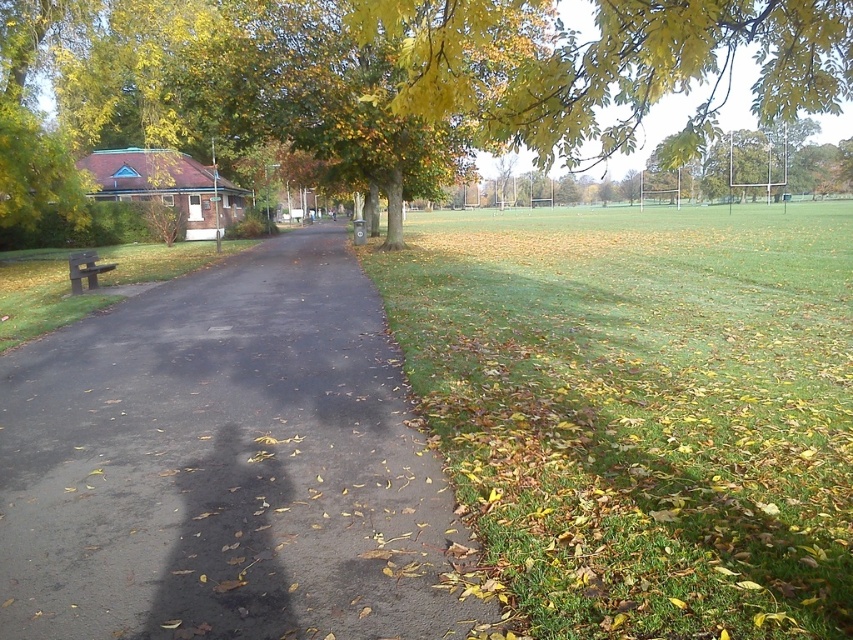
Question: Where is black asphalt pavement at left located in relation to green leafy tree at upper center in the image?

Choices:
 (A) below
 (B) above

Answer: (A)

Question: Where is black asphalt pavement at left located in relation to metallic park bench at left in the image?

Choices:
 (A) left
 (B) right

Answer: (B)

Question: Is the position of black asphalt pavement at left more distant than that of metallic park bench at left?

Choices:
 (A) yes
 (B) no

Answer: (B)

Question: Estimate the real-world distances between objects in this image. Which object is closer to the green leafy tree at upper center?

Choices:
 (A) metallic park bench at left
 (B) black asphalt pavement at left
 (C) green grass at right

Answer: (C)

Question: Which point is closer to the camera taking this photo?

Choices:
 (A) (714, 124)
 (B) (93, 256)
 (C) (762, 582)
 (D) (292, 385)

Answer: (C)

Question: Among these objects, which one is nearest to the camera?

Choices:
 (A) green grass at right
 (B) metallic park bench at left

Answer: (A)